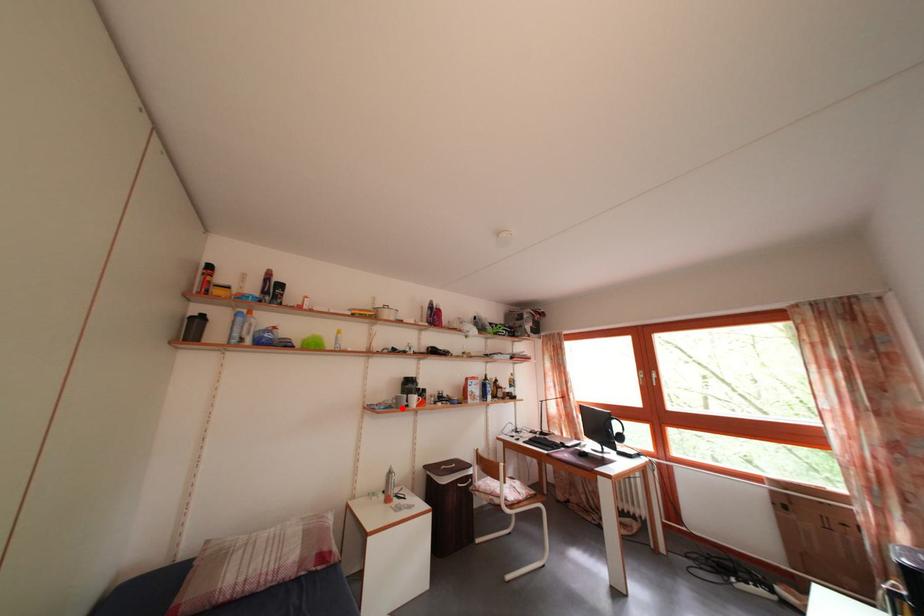
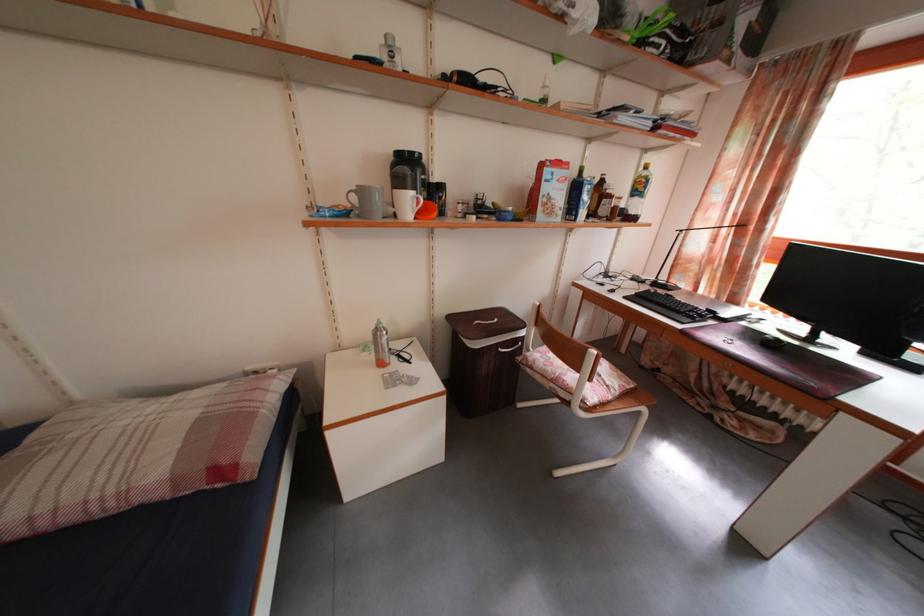
The point at the highlighted location is marked in the first image. Where is the corresponding point in the second image?

(361, 206)